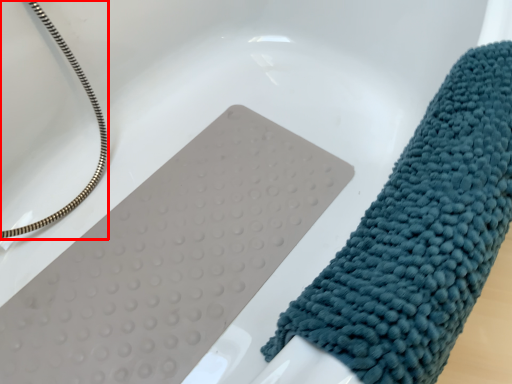
Question: From the image's perspective, where is rope (annotated by the red box) located relative to towel?

Choices:
 (A) above
 (B) below

Answer: (A)